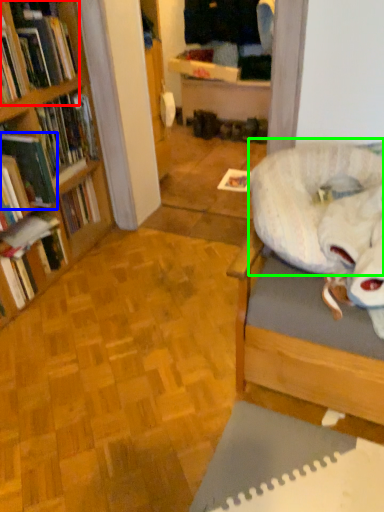
Question: Estimate the real-world distances between objects in this image. Which object is closer to book (highlighted by a red box), book (highlighted by a blue box) or bean bag chair (highlighted by a green box)?

Choices:
 (A) book
 (B) bean bag chair

Answer: (A)